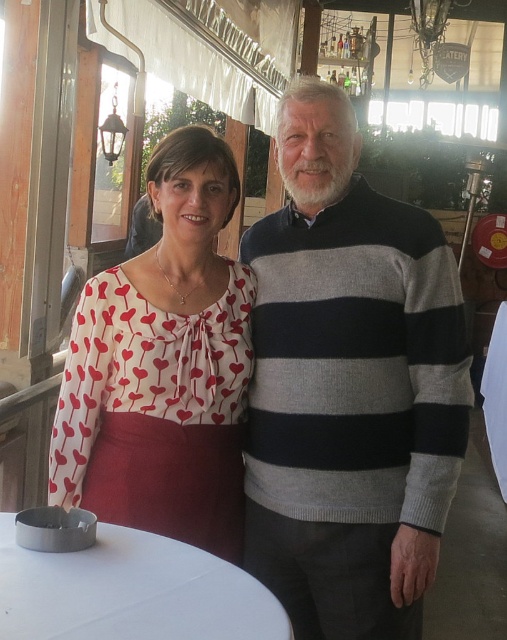
Please describe the position of the striped sweater at center in terms of coordinates within the image. The image has a coordinate system where the bottom left corner is the origin point. The x and y values range from 0 to 1, with 0 being the minimum and 1 the maximum in each axis. The coordinates are given as a pair of numbers in the format of x,y. Please provide your answer in the following format, using the exact object label from the Objects list and the coordinates from the Objects Description. Answer,

The striped sweater at center is located at coordinates [348,387] within the image.

You are a photographer setting up a shoot in this scene. You need to place a small prop between the striped sweater at center and the white printed blouse at center. Based on their positions, where should you place the prop?

The striped sweater at center is located below the white printed blouse at center, so you should place the prop between them vertically, positioning it either above the striped sweater at center or below the white printed blouse at center to maintain their spatial relationship.